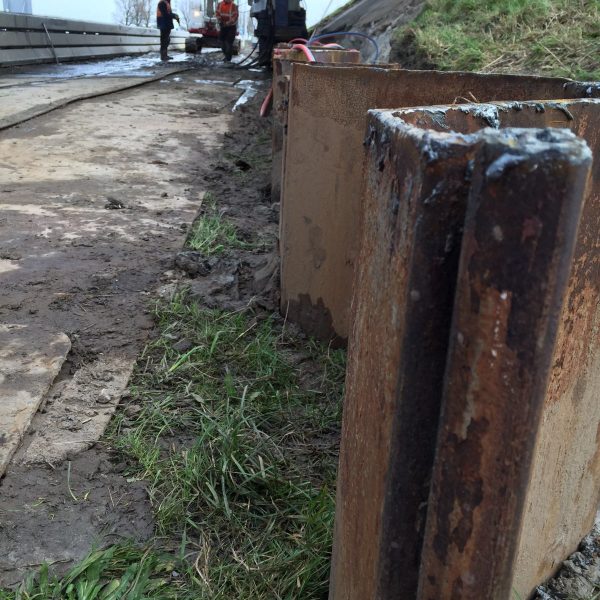
What are the coordinates of `wall` in the screenshot? It's located at (54, 47).